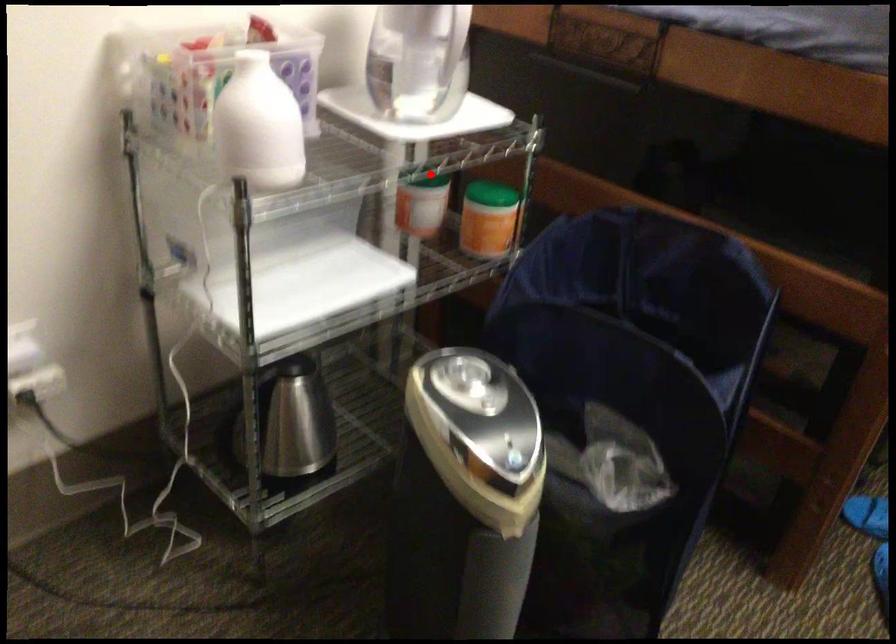
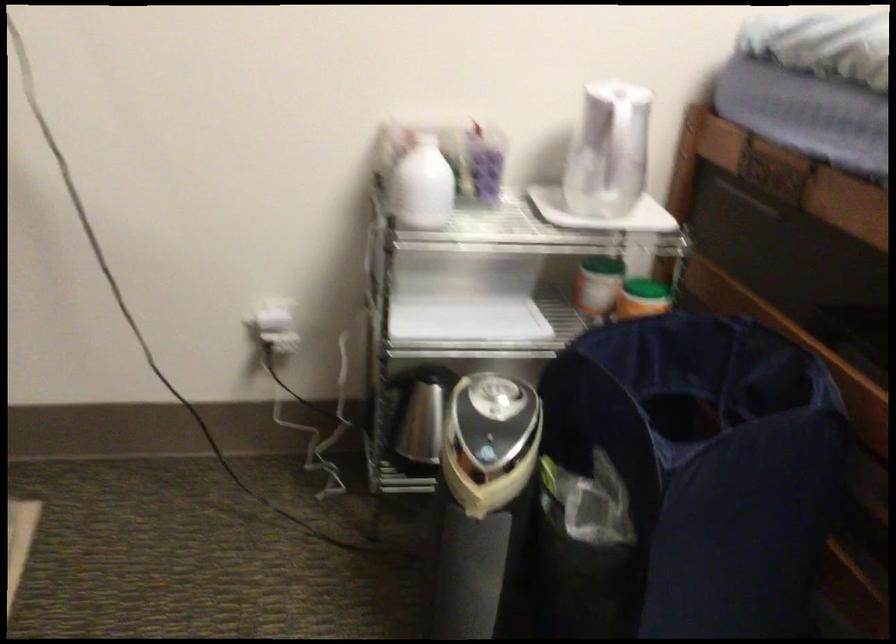
Find the pixel in the second image that matches the highlighted location in the first image.

(602, 263)